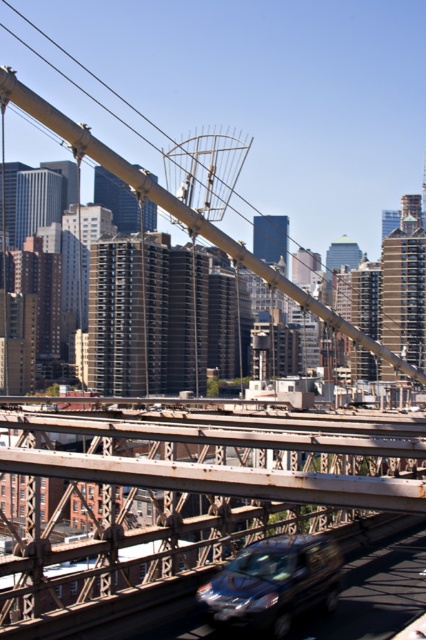
You are a photographer standing on the bridge and want to capture both the rusty metal bridge at center and the metallic silver van at center in a single shot. Which object should you position closer to the left side of your camera frame?

You should position the rusty metal bridge at center closer to the left side of your camera frame since it is already to the left of the metallic silver van at center.

In the scene shown: You are a drone operator trying to capture a photo of the rusty metal bridge at center and the metallic silver van at center. From your current position, can you see both objects simultaneously in your camera frame?

The rusty metal bridge at center is positioned under the metallic silver van at center, so yes, both objects can be seen in the same frame as the bridge is beneath the van.